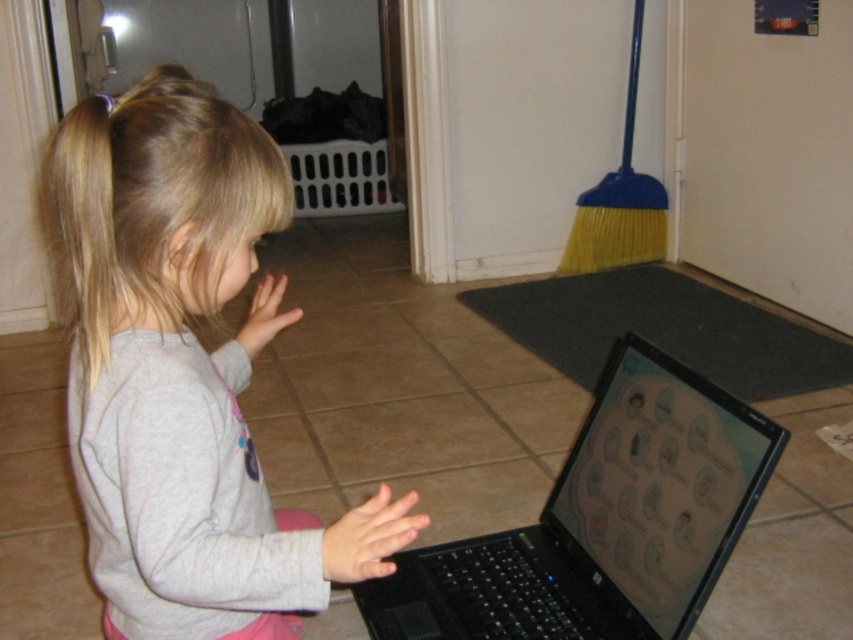
Who is positioned more to the right, gray soft fabric at center or black plastic laptop at center?

black plastic laptop at center is more to the right.

Is point (122, 112) closer to camera compared to point (566, 608)?

Yes.

Image resolution: width=853 pixels, height=640 pixels. In order to click on gray soft fabric at center in this screenshot , I will do `click(183, 369)`.